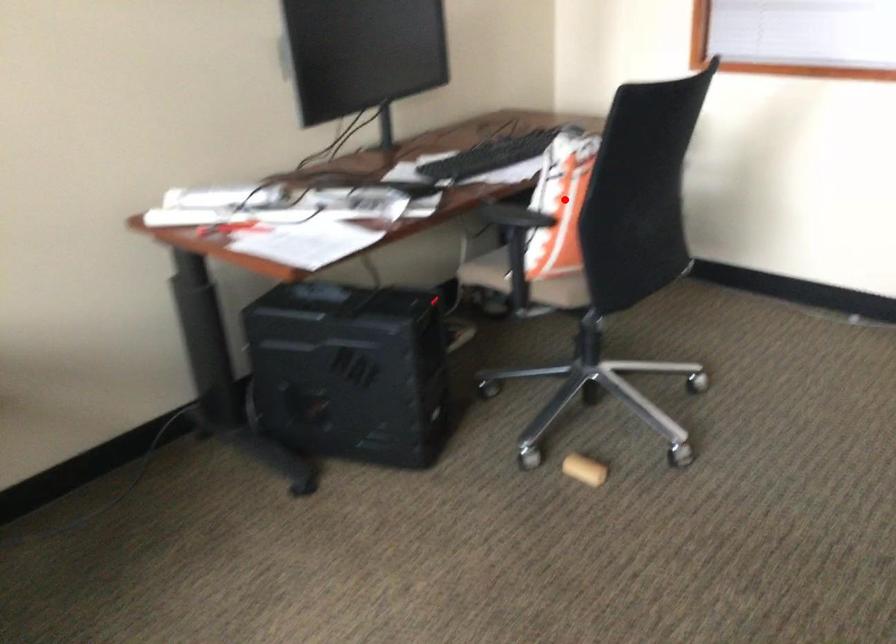
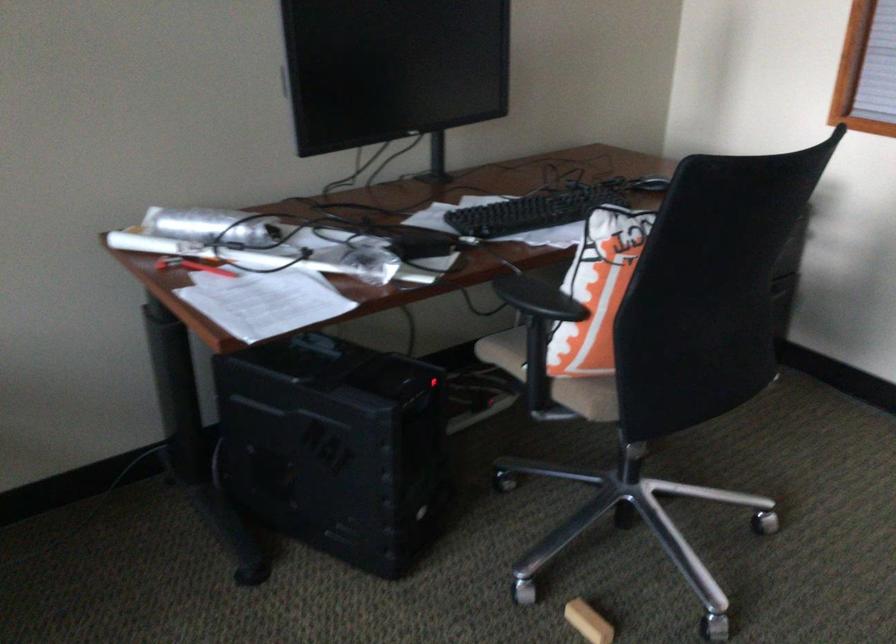
Question: I am providing you with two images of the same scene from different viewpoints. Image1 has a red point marked. In image2, the corresponding 3D location appears at what relative position? Reply with the corresponding letter.

Choices:
 (A) Closer
 (B) Farther

Answer: (A)